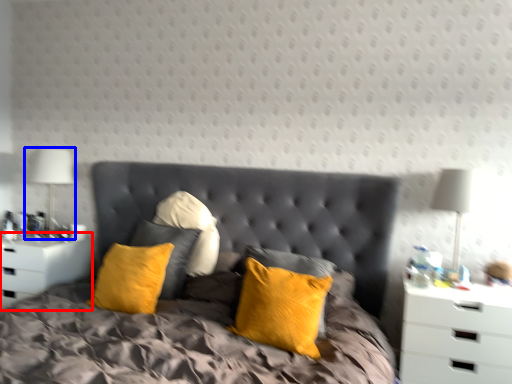
Question: Among these objects, which one is farthest to the camera, nightstand (highlighted by a red box) or bedside lamp (highlighted by a blue box)?

Choices:
 (A) nightstand
 (B) bedside lamp

Answer: (B)